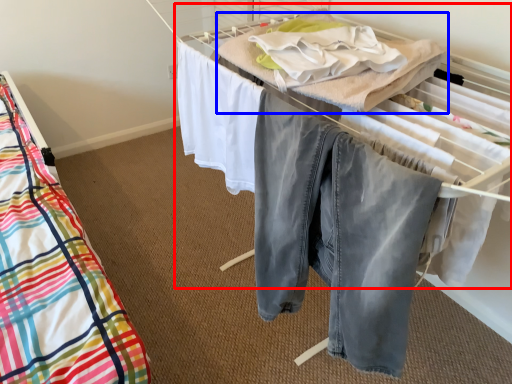
Question: Among these objects, which one is nearest to the camera, bed (highlighted by a red box) or blanket (highlighted by a blue box)?

Choices:
 (A) bed
 (B) blanket

Answer: (B)